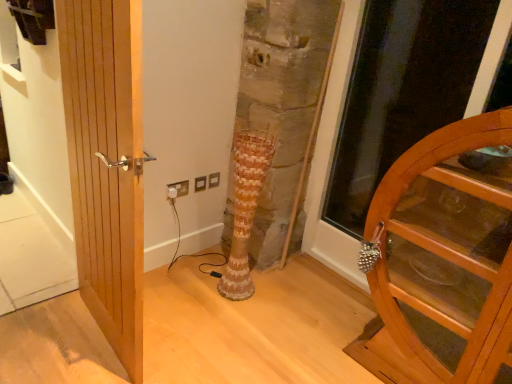
Where is `vacant space in front of natural wood door at left, the second door when ordered from right to left`? The height and width of the screenshot is (384, 512). vacant space in front of natural wood door at left, the second door when ordered from right to left is located at coordinates point(79,360).